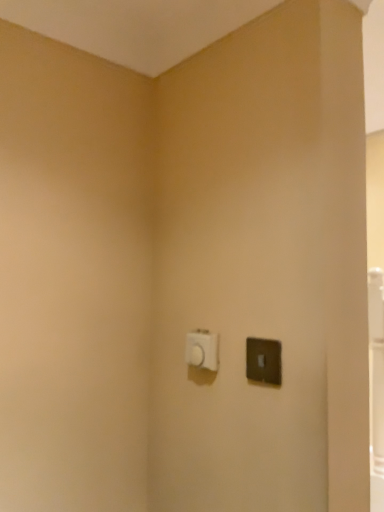
Question: From a real-world perspective, is satin black light switch at right, positioned as the first light switch in front-to-back order, located higher than white plastic light switch at center, marked as the second light switch in a right-to-left arrangement?

Choices:
 (A) no
 (B) yes

Answer: (A)

Question: Can you confirm if satin black light switch at right, positioned as the first light switch in front-to-back order, is smaller than white plastic light switch at center, placed as the 1th light switch when sorted from left to right?

Choices:
 (A) yes
 (B) no

Answer: (A)

Question: Can you confirm if satin black light switch at right, positioned as the 1th light switch in right-to-left order, is positioned to the left of white plastic light switch at center, placed as the second light switch when sorted from front to back?

Choices:
 (A) yes
 (B) no

Answer: (B)

Question: Is satin black light switch at right, positioned as the 1th light switch in right-to-left order, at the right side of white plastic light switch at center, placed as the 1th light switch when sorted from left to right?

Choices:
 (A) no
 (B) yes

Answer: (B)

Question: Does satin black light switch at right, which is the second light switch from back to front, contain white plastic light switch at center, marked as the second light switch in a right-to-left arrangement?

Choices:
 (A) no
 (B) yes

Answer: (A)

Question: Is there a large distance between satin black light switch at right, which is counted as the 2th light switch, starting from the left, and white plastic light switch at center, placed as the 1th light switch when sorted from left to right?

Choices:
 (A) no
 (B) yes

Answer: (A)

Question: Are white plastic light switch at center, the 1th light switch viewed from the back, and satin black light switch at right, which is counted as the 2th light switch, starting from the left, far apart?

Choices:
 (A) no
 (B) yes

Answer: (A)

Question: Is white plastic light switch at center, placed as the second light switch when sorted from front to back, next to satin black light switch at right, which is the second light switch from back to front?

Choices:
 (A) no
 (B) yes

Answer: (A)

Question: Considering the relative sizes of white plastic light switch at center, placed as the 1th light switch when sorted from left to right, and satin black light switch at right, which is counted as the 2th light switch, starting from the left, in the image provided, is white plastic light switch at center, placed as the 1th light switch when sorted from left to right, bigger than satin black light switch at right, which is counted as the 2th light switch, starting from the left,?

Choices:
 (A) yes
 (B) no

Answer: (A)

Question: From a real-world perspective, is white plastic light switch at center, placed as the second light switch when sorted from front to back, positioned over satin black light switch at right, which is counted as the 2th light switch, starting from the left, based on gravity?

Choices:
 (A) no
 (B) yes

Answer: (B)

Question: Is white plastic light switch at center, marked as the second light switch in a right-to-left arrangement, facing away from satin black light switch at right, positioned as the first light switch in front-to-back order?

Choices:
 (A) no
 (B) yes

Answer: (A)

Question: Considering the relative positions of white plastic light switch at center, the 1th light switch viewed from the back, and satin black light switch at right, which is counted as the 2th light switch, starting from the left, in the image provided, is white plastic light switch at center, the 1th light switch viewed from the back, behind satin black light switch at right, which is counted as the 2th light switch, starting from the left,?

Choices:
 (A) no
 (B) yes

Answer: (B)

Question: From a real-world perspective, is white plastic light switch at center, placed as the second light switch when sorted from front to back, physically located above or below satin black light switch at right, which is counted as the 2th light switch, starting from the left?

Choices:
 (A) below
 (B) above

Answer: (B)